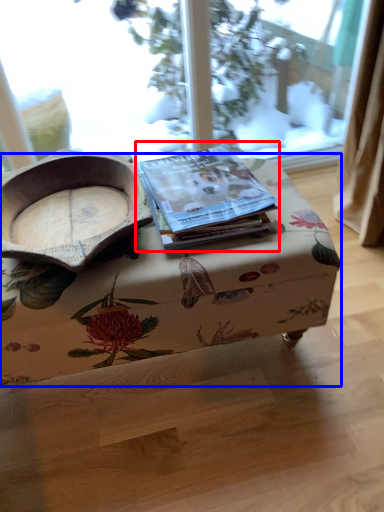
Question: Which of the following is the farthest to the observer, paperback book (highlighted by a red box) or table (highlighted by a blue box)?

Choices:
 (A) paperback book
 (B) table

Answer: (A)